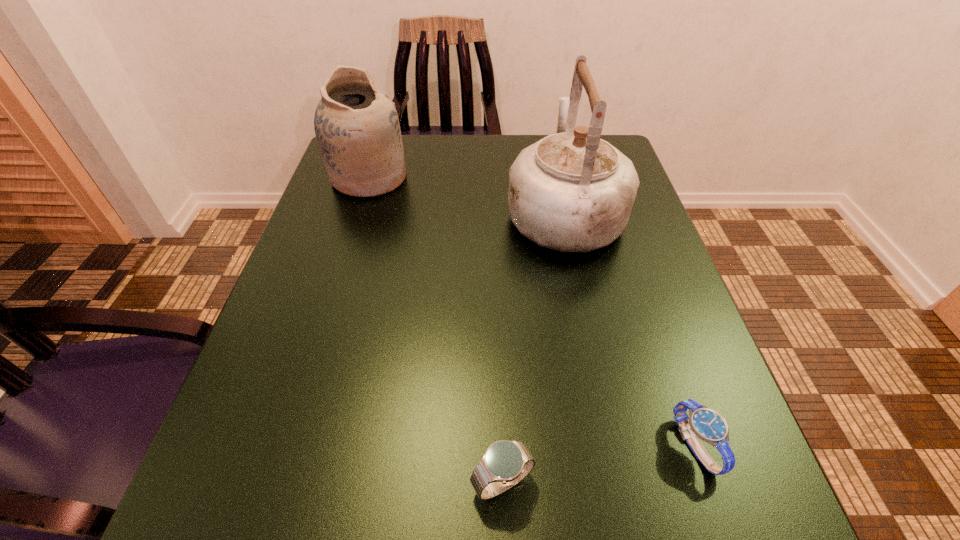
The width and height of the screenshot is (960, 540). In order to click on free location located 0.240m on the front of the second tallest object in this screenshot , I will do `click(338, 278)`.

Find the location of a particular element. The image size is (960, 540). free space located 0.310m on the left of the taller watch is located at coordinates (230, 483).

Locate an element on the screen. This screenshot has width=960, height=540. vacant position located on the back of the shorter watch is located at coordinates (636, 274).

Locate an element on the screen. The height and width of the screenshot is (540, 960). kettle located in the far edge section of the desktop is located at coordinates [x=571, y=191].

The width and height of the screenshot is (960, 540). What are the coordinates of `pottery at the far edge` in the screenshot? It's located at (357, 128).

The image size is (960, 540). What are the coordinates of `object that is at the near edge` in the screenshot? It's located at 505,463.

You are a GUI agent. You are given a task and a screenshot of the screen. Output one action in this format:
    pyautogui.click(x=<x>, y=<y>)
    Task: Click on the object that is at the left edge
    
    Given the screenshot: What is the action you would take?
    pyautogui.click(x=357, y=128)

This screenshot has width=960, height=540. What are the coordinates of `kettle that is at the right edge` in the screenshot? It's located at (571, 191).

Locate an element on the screen. This screenshot has height=540, width=960. watch positioned at the right edge is located at coordinates click(x=708, y=425).

This screenshot has width=960, height=540. I want to click on object that is at the far left corner, so click(357, 128).